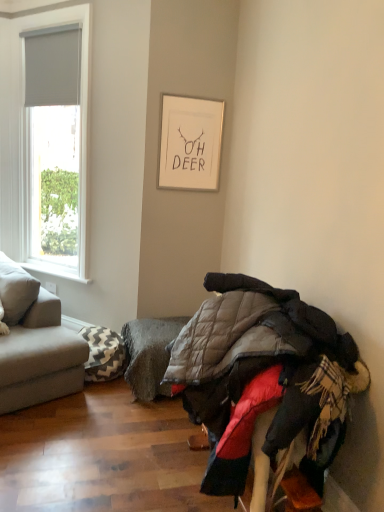
Question: From a real-world perspective, is white matte picture frame at upper center located higher than gray fabric couch at left?

Choices:
 (A) yes
 (B) no

Answer: (A)

Question: Is white matte picture frame at upper center not close to gray fabric couch at left?

Choices:
 (A) yes
 (B) no

Answer: (A)

Question: Is white matte picture frame at upper center surrounding gray fabric couch at left?

Choices:
 (A) no
 (B) yes

Answer: (A)

Question: From the image's perspective, is white matte picture frame at upper center located beneath gray fabric couch at left?

Choices:
 (A) yes
 (B) no

Answer: (B)

Question: Does white matte picture frame at upper center have a greater width compared to gray fabric couch at left?

Choices:
 (A) no
 (B) yes

Answer: (A)

Question: Considering the relative sizes of white matte picture frame at upper center and gray fabric couch at left in the image provided, is white matte picture frame at upper center bigger than gray fabric couch at left?

Choices:
 (A) yes
 (B) no

Answer: (B)

Question: Does gray fabric blind at upper left have a smaller size compared to gray textured footrest at lower center?

Choices:
 (A) yes
 (B) no

Answer: (A)

Question: Considering the relative sizes of gray fabric blind at upper left and gray textured footrest at lower center in the image provided, is gray fabric blind at upper left wider than gray textured footrest at lower center?

Choices:
 (A) no
 (B) yes

Answer: (A)

Question: Would you say gray fabric blind at upper left contains gray textured footrest at lower center?

Choices:
 (A) no
 (B) yes

Answer: (A)

Question: Is gray fabric blind at upper left positioned behind gray textured footrest at lower center?

Choices:
 (A) no
 (B) yes

Answer: (B)

Question: Is gray fabric blind at upper left not inside gray textured footrest at lower center?

Choices:
 (A) yes
 (B) no

Answer: (A)

Question: Would you say gray fabric blind at upper left is a long distance from gray textured footrest at lower center?

Choices:
 (A) no
 (B) yes

Answer: (B)

Question: Is the depth of gray textured footrest at lower center less than that of gray fabric blind at upper left?

Choices:
 (A) yes
 (B) no

Answer: (A)